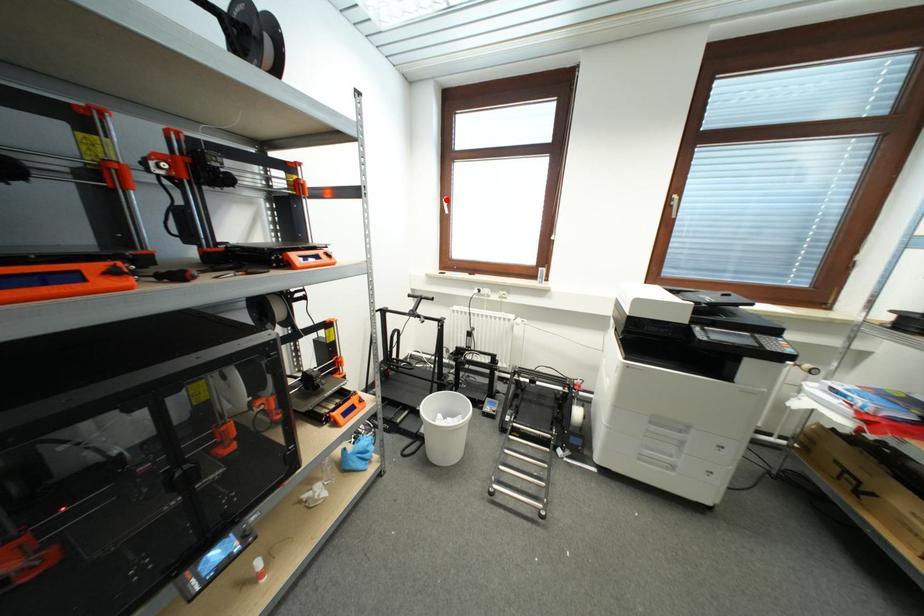
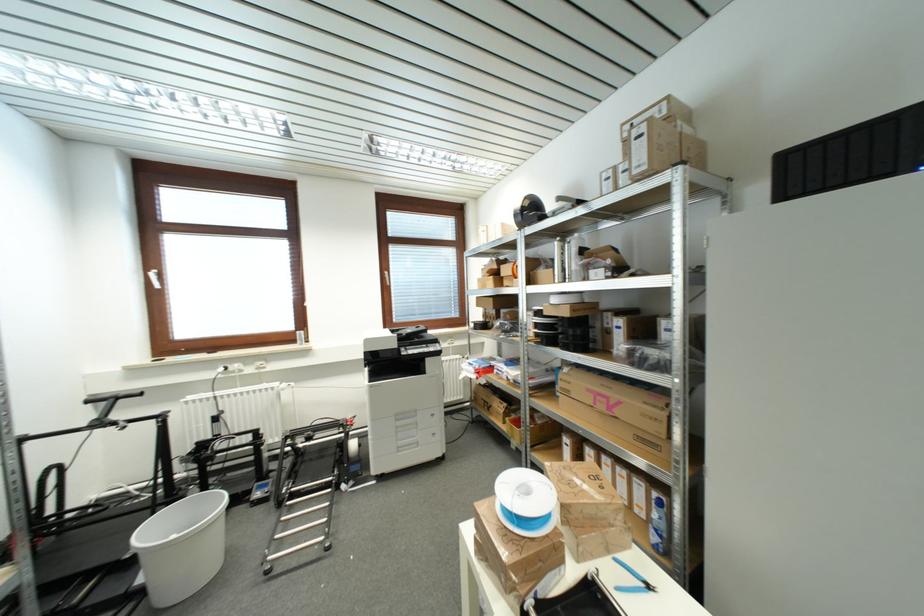
Question: I am providing you with two images of the same scene from different viewpoints. Given a red point in image1, look at the same physical point in image2. Is it:

Choices:
 (A) Closer to the viewpoint
 (B) Farther from the viewpoint

Answer: (B)